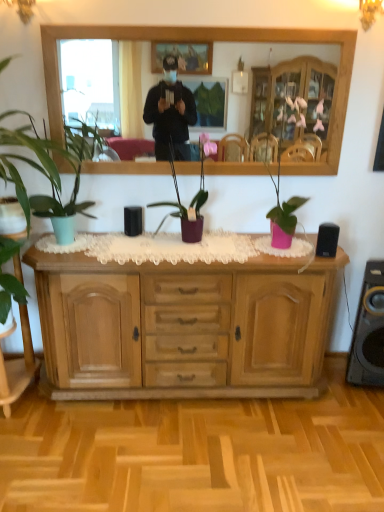
Question: Considering the relative positions of green matte plant at left, acting as the third houseplant starting from the right, and black matte speaker at right in the image provided, is green matte plant at left, acting as the third houseplant starting from the right, to the right of black matte speaker at right from the viewer's perspective?

Choices:
 (A) yes
 (B) no

Answer: (B)

Question: Would you consider green matte plant at left, positioned as the first houseplant in left-to-right order, to be distant from black matte speaker at right?

Choices:
 (A) no
 (B) yes

Answer: (B)

Question: Is green matte plant at left, acting as the third houseplant starting from the right, bigger than black matte speaker at right?

Choices:
 (A) no
 (B) yes

Answer: (B)

Question: From a real-world perspective, is green matte plant at left, positioned as the first houseplant in left-to-right order, beneath black matte speaker at right?

Choices:
 (A) yes
 (B) no

Answer: (B)

Question: Is green matte plant at left, acting as the third houseplant starting from the right, taller than black matte speaker at right?

Choices:
 (A) no
 (B) yes

Answer: (B)

Question: Is green matte plant at left, acting as the third houseplant starting from the right, wider than black matte speaker at right?

Choices:
 (A) no
 (B) yes

Answer: (B)

Question: Is matte purple pot at center, which is the 1th houseplant from right to left, far from matte green plant at left, the 2th houseplant in the left-to-right sequence?

Choices:
 (A) no
 (B) yes

Answer: (A)

Question: Is matte purple pot at center, which is the 1th houseplant from right to left, closer to the viewer compared to matte green plant at left, the second houseplant when ordered from right to left?

Choices:
 (A) yes
 (B) no

Answer: (B)

Question: Considering the relative sizes of matte purple pot at center, which is the 1th houseplant from right to left, and matte green plant at left, the 2th houseplant in the left-to-right sequence, in the image provided, is matte purple pot at center, which is the 1th houseplant from right to left, smaller than matte green plant at left, the 2th houseplant in the left-to-right sequence,?

Choices:
 (A) no
 (B) yes

Answer: (B)

Question: Considering the relative positions of matte purple pot at center, which is the third houseplant in left-to-right order, and matte green plant at left, the 2th houseplant in the left-to-right sequence, in the image provided, is matte purple pot at center, which is the third houseplant in left-to-right order, to the right of matte green plant at left, the 2th houseplant in the left-to-right sequence, from the viewer's perspective?

Choices:
 (A) no
 (B) yes

Answer: (B)

Question: Does matte purple pot at center, which is the 1th houseplant from right to left, have a lesser height compared to matte green plant at left, the second houseplant when ordered from right to left?

Choices:
 (A) no
 (B) yes

Answer: (B)

Question: Considering the relative sizes of matte purple pot at center, which is the 1th houseplant from right to left, and matte green plant at left, the 2th houseplant in the left-to-right sequence, in the image provided, is matte purple pot at center, which is the 1th houseplant from right to left, thinner than matte green plant at left, the 2th houseplant in the left-to-right sequence,?

Choices:
 (A) no
 (B) yes

Answer: (B)

Question: Can you confirm if green matte plant at left, acting as the third houseplant starting from the right, is positioned to the left of matte purple pot at center, which is the 1th houseplant from right to left?

Choices:
 (A) yes
 (B) no

Answer: (A)